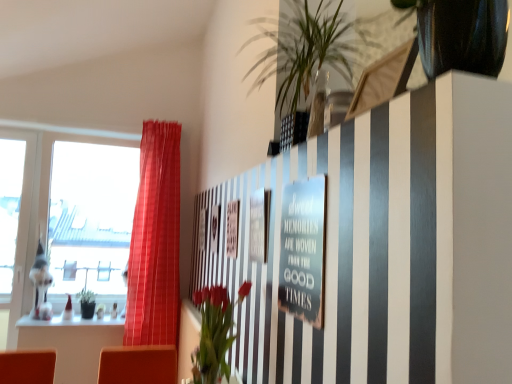
Question: Is point (141, 286) closer or farther from the camera than point (222, 317)?

Choices:
 (A) closer
 (B) farther

Answer: (B)

Question: In the image, is matte red curtain at left positioned in front of or behind vivid red flowers at center?

Choices:
 (A) behind
 (B) front

Answer: (A)

Question: Estimate the real-world distances between objects in this image. Which object is farther from the matte glass vase at upper center?

Choices:
 (A) matte red curtain at left
 (B) transparent glass window at left
 (C) metallic silver sign at center
 (D) vivid red flowers at center
 (E) green leafy plant at upper center

Answer: (B)

Question: Which of these objects is positioned farthest from the vivid red flowers at center?

Choices:
 (A) matte glass vase at upper center
 (B) green leafy plant at upper center
 (C) transparent glass window at left
 (D) metallic silver sign at center
 (E) matte red curtain at left

Answer: (C)